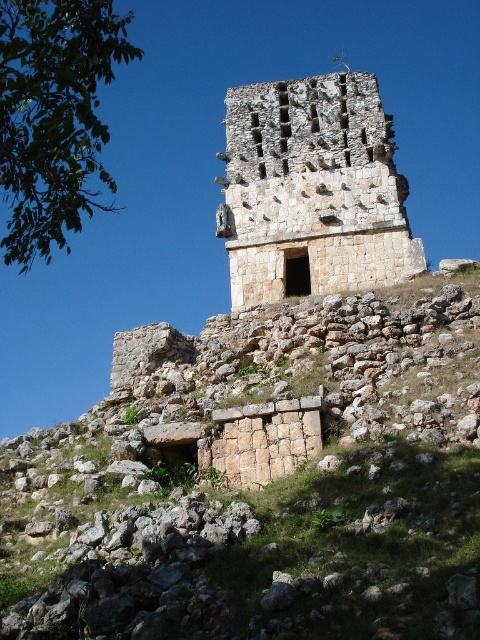
Question: Among these points, which one is nearest to the camera?

Choices:
 (A) (420, 634)
 (B) (244, 240)

Answer: (A)

Question: Which object is farther from the camera taking this photo?

Choices:
 (A) rustic stone wall at center
 (B) rustic stone tower at center

Answer: (B)

Question: Can you confirm if rustic stone wall at center is wider than rustic stone tower at center?

Choices:
 (A) yes
 (B) no

Answer: (A)

Question: Can you confirm if rustic stone wall at center is bigger than rustic stone tower at center?

Choices:
 (A) yes
 (B) no

Answer: (A)

Question: Can you confirm if rustic stone wall at center is positioned to the left of rustic stone tower at center?

Choices:
 (A) yes
 (B) no

Answer: (A)